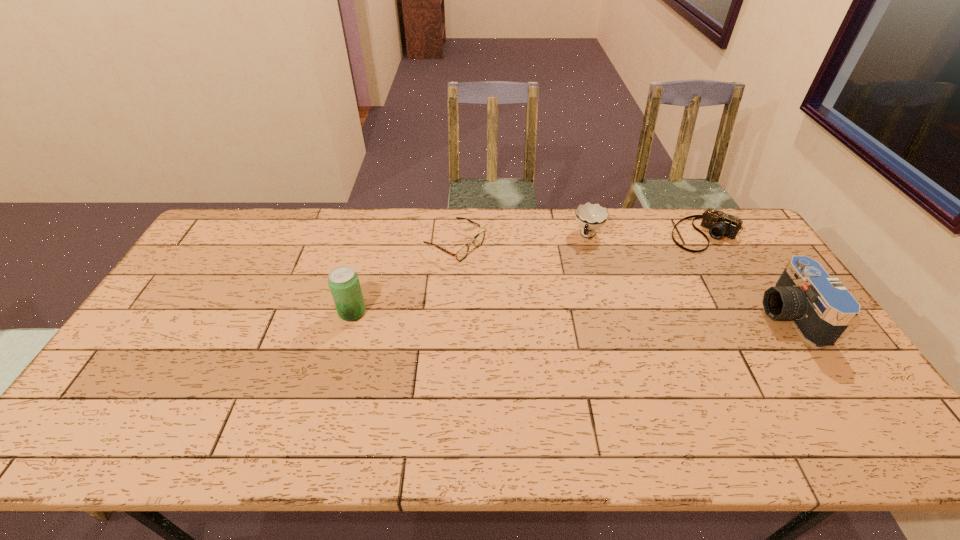
You are a GUI agent. You are given a task and a screenshot of the screen. Output one action in this format:
    pyautogui.click(x=<x>, y=<y>)
    Task: Click on the vacant space located on the front-facing side of the taller camera
    
    Given the screenshot: What is the action you would take?
    pyautogui.click(x=660, y=315)

I want to click on free space located 0.300m on the front-facing side of the taller camera, so click(x=660, y=315).

The image size is (960, 540). What are the coordinates of `free space located 0.310m on the frame of the second object from left to right` in the screenshot? It's located at (562, 300).

You are a GUI agent. You are given a task and a screenshot of the screen. Output one action in this format:
    pyautogui.click(x=<x>, y=<y>)
    Task: Click on the free region located on the frame of the second object from left to right
    This screenshot has height=540, width=960.
    Given the screenshot: What is the action you would take?
    pyautogui.click(x=571, y=304)

In order to click on free location located 0.180m on the frame of the second object from left to right in this screenshot , I will do `click(526, 281)`.

Find the location of a particular element. vacant region located 0.140m on the front-facing side of the second shortest object is located at coordinates (668, 267).

Locate an element on the screen. This screenshot has height=540, width=960. free space located on the front-facing side of the second shortest object is located at coordinates (650, 287).

Locate an element on the screen. free space located on the front-facing side of the second shortest object is located at coordinates (651, 285).

You are a GUI agent. You are given a task and a screenshot of the screen. Output one action in this format:
    pyautogui.click(x=<x>, y=<y>)
    Task: Click on the free space located on the side of the third shortest object with the handle
    This screenshot has width=960, height=540.
    Given the screenshot: What is the action you would take?
    pyautogui.click(x=564, y=300)

The width and height of the screenshot is (960, 540). I want to click on vacant space situated 0.130m on the side of the third shortest object with the handle, so click(x=575, y=271).